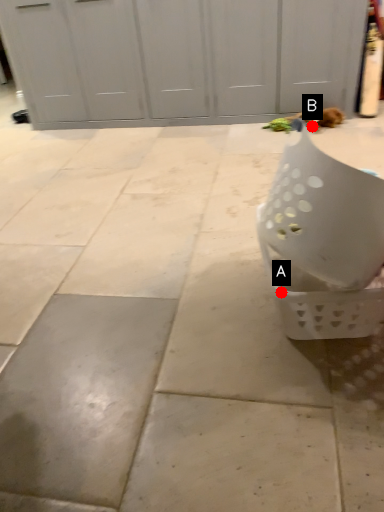
Question: Two points are circled on the image, labeled by A and B beside each circle. Which point is closer to the camera?

Choices:
 (A) A is closer
 (B) B is closer

Answer: (A)